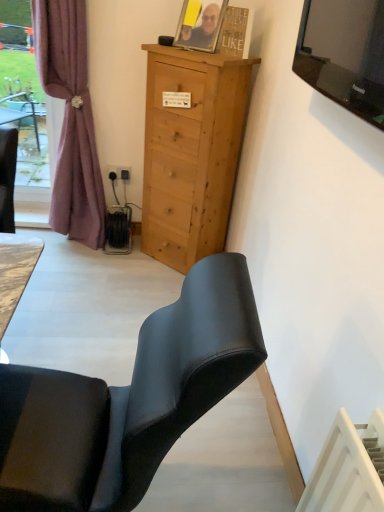
Question: Considering the relative positions of mauve fabric curtain at left and matte black photo frame at upper center in the image provided, is mauve fabric curtain at left to the left of matte black photo frame at upper center from the viewer's perspective?

Choices:
 (A) yes
 (B) no

Answer: (A)

Question: Can you confirm if mauve fabric curtain at left is wider than matte black photo frame at upper center?

Choices:
 (A) yes
 (B) no

Answer: (A)

Question: Is mauve fabric curtain at left facing away from matte black photo frame at upper center?

Choices:
 (A) yes
 (B) no

Answer: (B)

Question: Can matte black photo frame at upper center be found inside mauve fabric curtain at left?

Choices:
 (A) no
 (B) yes

Answer: (A)

Question: Does mauve fabric curtain at left lie behind matte black photo frame at upper center?

Choices:
 (A) no
 (B) yes

Answer: (A)

Question: Is mauve fabric curtain at left in front of matte black photo frame at upper center?

Choices:
 (A) no
 (B) yes

Answer: (B)

Question: Can you confirm if mauve fabric curtain at left is thinner than matte black chair at lower left?

Choices:
 (A) no
 (B) yes

Answer: (B)

Question: Would you say mauve fabric curtain at left is outside matte black chair at lower left?

Choices:
 (A) yes
 (B) no

Answer: (A)

Question: Is mauve fabric curtain at left with matte black chair at lower left?

Choices:
 (A) no
 (B) yes

Answer: (A)

Question: Does mauve fabric curtain at left appear on the left side of matte black chair at lower left?

Choices:
 (A) no
 (B) yes

Answer: (B)

Question: Is mauve fabric curtain at left to the right of matte black chair at lower left from the viewer's perspective?

Choices:
 (A) yes
 (B) no

Answer: (B)

Question: From the image's perspective, is mauve fabric curtain at left over matte black chair at lower left?

Choices:
 (A) yes
 (B) no

Answer: (A)

Question: Can you confirm if light brown wood cabinet at center is smaller than black plastic power outlet at lower left?

Choices:
 (A) no
 (B) yes

Answer: (A)